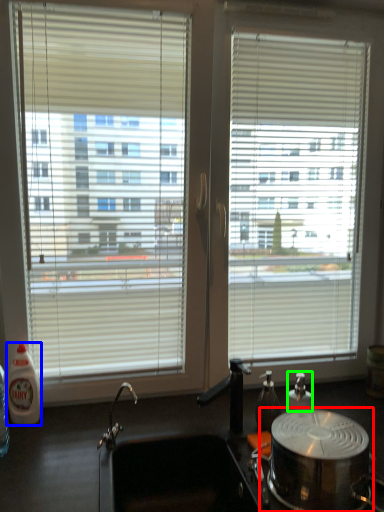
Question: Which is nearer to the appliance (highlighted by a red box)? bottle (highlighted by a blue box) or bottle (highlighted by a green box).

Choices:
 (A) bottle
 (B) bottle

Answer: (B)